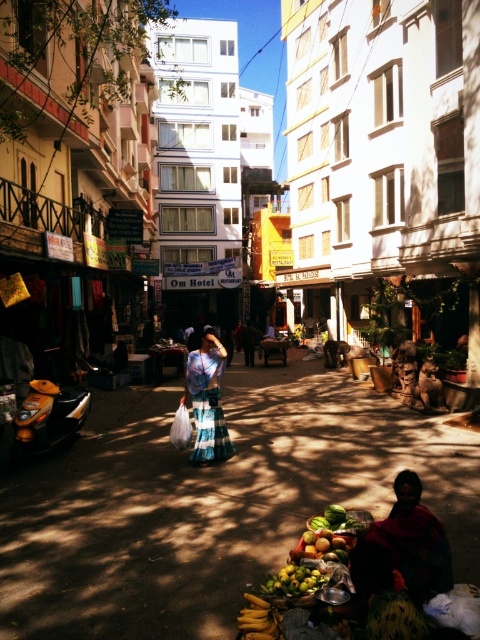
Looking at this image, does matte blue dress at center appear on the right side of shiny green melon at lower center?

In fact, matte blue dress at center is to the left of shiny green melon at lower center.

Does point (338, 404) come behind point (310, 554)?

That is True.

What are the coordinates of `matte blue dress at center` in the screenshot? It's located at 212,502.

Between matte blue dress at center and blue plaid skirt at center, which one is positioned lower?

matte blue dress at center

Is point (466, 572) behind point (215, 392)?

No, (466, 572) is in front of (215, 392).

Who is more forward, (x=15, y=483) or (x=222, y=410)?

Positioned in front is point (x=15, y=483).

I want to click on matte blue dress at center, so click(x=212, y=502).

Which is behind, point (205, 410) or point (303, 584)?

The point (205, 410) is behind.

Locate an element on the screen. The height and width of the screenshot is (640, 480). blue plaid skirt at center is located at coordinates (206, 400).